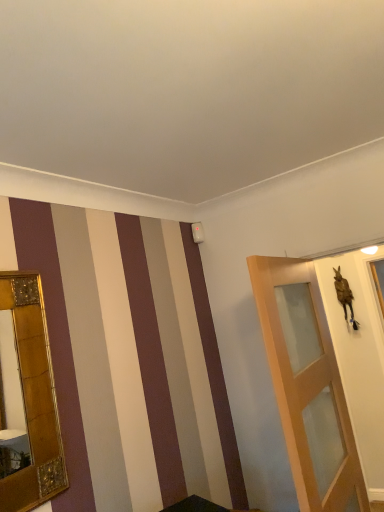
Identify the location of light wood door at right. (307, 386).

Describe the element at coordinates (307, 386) in the screenshot. The width and height of the screenshot is (384, 512). I see `light wood door at right` at that location.

Identify the location of light wood door at right. pos(307,386).